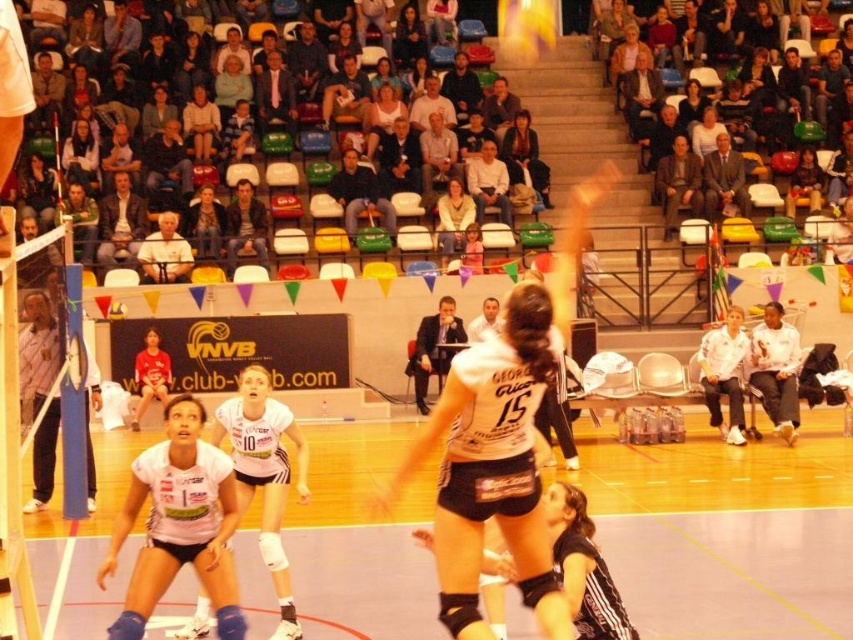
You are a photographer trying to capture a clear shot of both the smooth white blouse at upper center and the matte white shirt at center during the volleyball match. Which clothing item is located lower in the image?

The smooth white blouse at upper center is positioned under the matte white shirt at center, so the smooth white blouse at upper center is lower in the image.

Looking at this image, you are a photographer standing at the center of the volleyball court. You want to take a photo of the white matte jersey at center. Where should you aim your camera?

You should aim your camera at point 0.692 on the x axis and 0.589 on the y axis to capture the white matte jersey at center.

You are a photographer standing at the back of the sports hall. You want to take a photo of the white matte jersey at center and the white matte volleyball player at center. Which one should you focus on first if you want to capture both in the frame without moving the camera?

The white matte jersey at center is to the right of the white matte volleyball player at center, so you should focus on the white matte volleyball player at center first to ensure both are in frame.